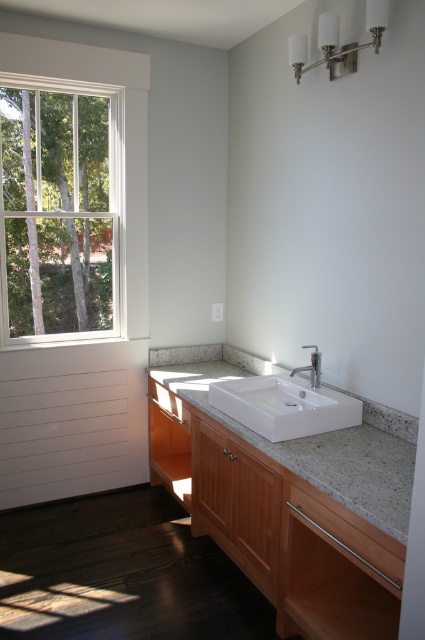
Question: Which object appears closest to the camera in this image?

Choices:
 (A) granite countertop at center
 (B) white wood window at left
 (C) white ceramic sink at center
 (D) satin nickel faucet at center

Answer: (A)

Question: Estimate the real-world distances between objects in this image. Which object is closer to the satin nickel faucet at center?

Choices:
 (A) granite countertop at center
 (B) white ceramic sink at center

Answer: (B)

Question: Among these points, which one is farthest from the camera?

Choices:
 (A) (348, 419)
 (B) (13, 177)

Answer: (B)

Question: Can you confirm if white ceramic sink at center is positioned to the left of satin nickel faucet at center?

Choices:
 (A) no
 (B) yes

Answer: (B)

Question: Is white wood window at left smaller than satin nickel faucet at center?

Choices:
 (A) yes
 (B) no

Answer: (B)

Question: Can you confirm if white wood window at left is bigger than satin nickel faucet at center?

Choices:
 (A) no
 (B) yes

Answer: (B)